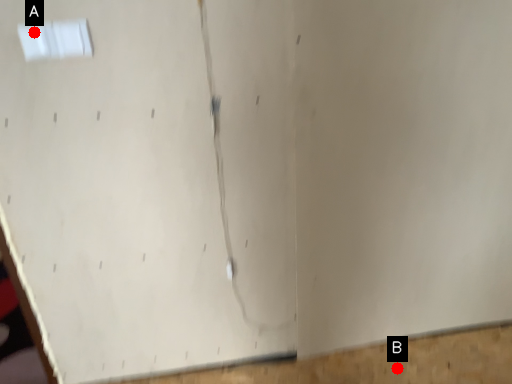
Question: Two points are circled on the image, labeled by A and B beside each circle. Among these points, which one is nearest to the camera?

Choices:
 (A) A is closer
 (B) B is closer

Answer: (A)